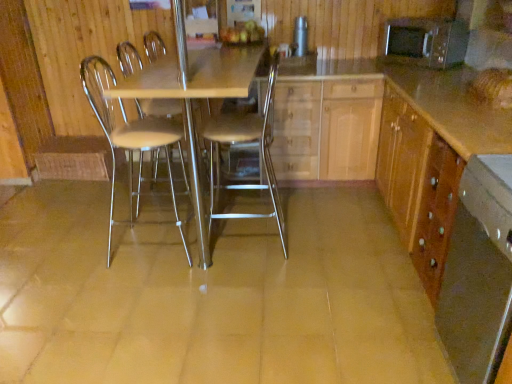
The height and width of the screenshot is (384, 512). I want to click on free space in front of metallic silver chair at center, the 2th chair when ordered from right to left, so click(x=143, y=291).